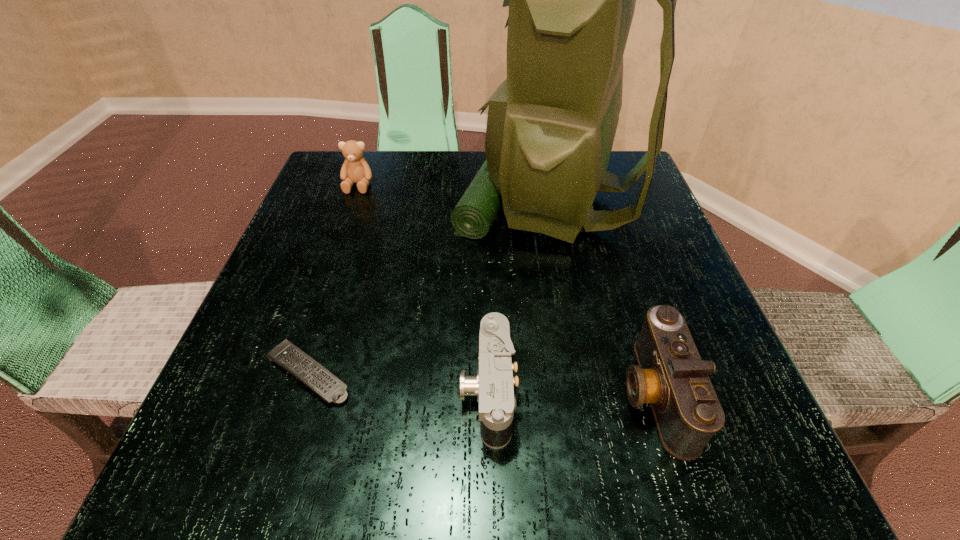
The height and width of the screenshot is (540, 960). Find the location of `free region located 0.300m on the lens of the taller camera`. free region located 0.300m on the lens of the taller camera is located at coordinates (414, 393).

The height and width of the screenshot is (540, 960). What are the coordinates of `vacant space situated on the lens of the taller camera` in the screenshot? It's located at (372, 393).

What are the coordinates of `vacant space located 0.060m on the lens of the taller camera` in the screenshot? It's located at (580, 393).

You are a GUI agent. You are given a task and a screenshot of the screen. Output one action in this format:
    pyautogui.click(x=<x>, y=<y>)
    Task: Click on the free space located 0.340m on the lens of the fourth tallest object
    
    Given the screenshot: What is the action you would take?
    pyautogui.click(x=228, y=390)

Identify the location of free space located on the lens of the fourth tallest object. (399, 390).

Image resolution: width=960 pixels, height=540 pixels. I want to click on vacant space located on the lens of the fourth tallest object, so click(269, 390).

Where is `vacant space situated 0.270m on the right of the remote control`? The width and height of the screenshot is (960, 540). vacant space situated 0.270m on the right of the remote control is located at coordinates (535, 373).

You are a GUI agent. You are given a task and a screenshot of the screen. Output one action in this format:
    pyautogui.click(x=<x>, y=<y>)
    Task: Click on the backpack situated at the far edge
    Image resolution: width=960 pixels, height=540 pixels.
    Given the screenshot: What is the action you would take?
    pyautogui.click(x=551, y=124)

You are a GUI agent. You are given a task and a screenshot of the screen. Output one action in this format:
    pyautogui.click(x=<x>, y=<y>)
    Task: Click on the teddy bear that is at the far edge
    
    Given the screenshot: What is the action you would take?
    pyautogui.click(x=355, y=169)

The width and height of the screenshot is (960, 540). I want to click on teddy bear present at the left edge, so click(355, 169).